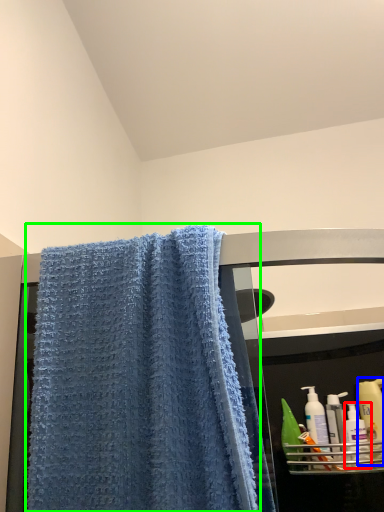
Question: Considering the real-world distances, which object is farthest from cleaning product (highlighted by a red box)? cleaning product (highlighted by a blue box) or towel (highlighted by a green box)?

Choices:
 (A) cleaning product
 (B) towel

Answer: (B)